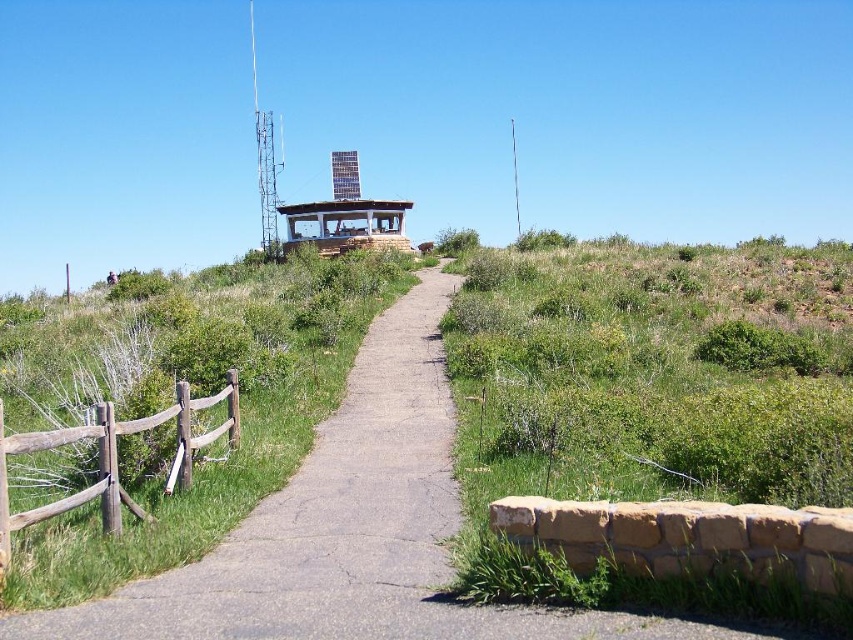
Which is below, brown wooden fence at left or wooden gazebo at center?

brown wooden fence at left is below.

Does brown wooden fence at left appear on the left side of wooden gazebo at center?

No, brown wooden fence at left is not to the left of wooden gazebo at center.

Describe the element at coordinates (113, 458) in the screenshot. This screenshot has width=853, height=640. I see `brown wooden fence at left` at that location.

The width and height of the screenshot is (853, 640). Identify the location of brown wooden fence at left. 113,458.